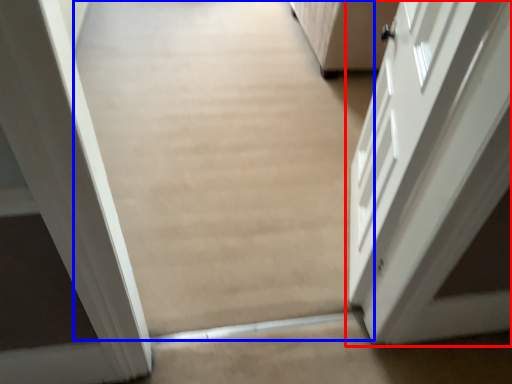
Question: Which object appears farthest to the camera in this image, door (highlighted by a red box) or plain (highlighted by a blue box)?

Choices:
 (A) door
 (B) plain

Answer: (A)